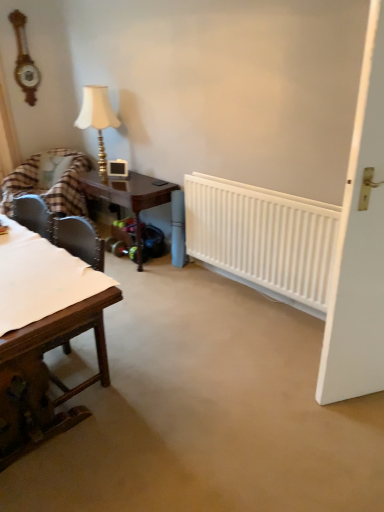
Question: From the image's perspective, does matte gold table lamp at upper left appear lower than white matte door at right?

Choices:
 (A) no
 (B) yes

Answer: (A)

Question: Could you tell me if matte gold table lamp at upper left is facing white matte door at right?

Choices:
 (A) no
 (B) yes

Answer: (A)

Question: Considering the relative sizes of matte gold table lamp at upper left and white matte door at right in the image provided, is matte gold table lamp at upper left taller than white matte door at right?

Choices:
 (A) no
 (B) yes

Answer: (A)

Question: Is white matte door at right at the back of matte gold table lamp at upper left?

Choices:
 (A) yes
 (B) no

Answer: (B)

Question: Does matte gold table lamp at upper left have a larger size compared to white matte door at right?

Choices:
 (A) yes
 (B) no

Answer: (B)

Question: Does matte gold table lamp at upper left appear on the left side of white matte door at right?

Choices:
 (A) yes
 (B) no

Answer: (A)

Question: Is plaid fabric chair at left oriented towards white plastic radiator at center?

Choices:
 (A) no
 (B) yes

Answer: (A)

Question: Does plaid fabric chair at left appear on the right side of white plastic radiator at center?

Choices:
 (A) no
 (B) yes

Answer: (A)

Question: Can you confirm if plaid fabric chair at left is wider than white plastic radiator at center?

Choices:
 (A) no
 (B) yes

Answer: (B)

Question: Is plaid fabric chair at left shorter than white plastic radiator at center?

Choices:
 (A) yes
 (B) no

Answer: (B)

Question: From the image's perspective, is plaid fabric chair at left located beneath white plastic radiator at center?

Choices:
 (A) yes
 (B) no

Answer: (B)

Question: Is plaid fabric chair at left thinner than white plastic radiator at center?

Choices:
 (A) yes
 (B) no

Answer: (B)

Question: Is white plastic radiator at center positioned far away from plaid fabric chair at left?

Choices:
 (A) no
 (B) yes

Answer: (B)